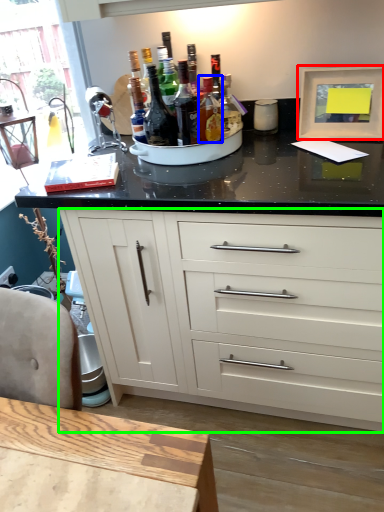
Question: Which is farther away from picture frame (highlighted by a red box)? bottle (highlighted by a blue box) or cabinetry (highlighted by a green box)?

Choices:
 (A) bottle
 (B) cabinetry

Answer: (B)